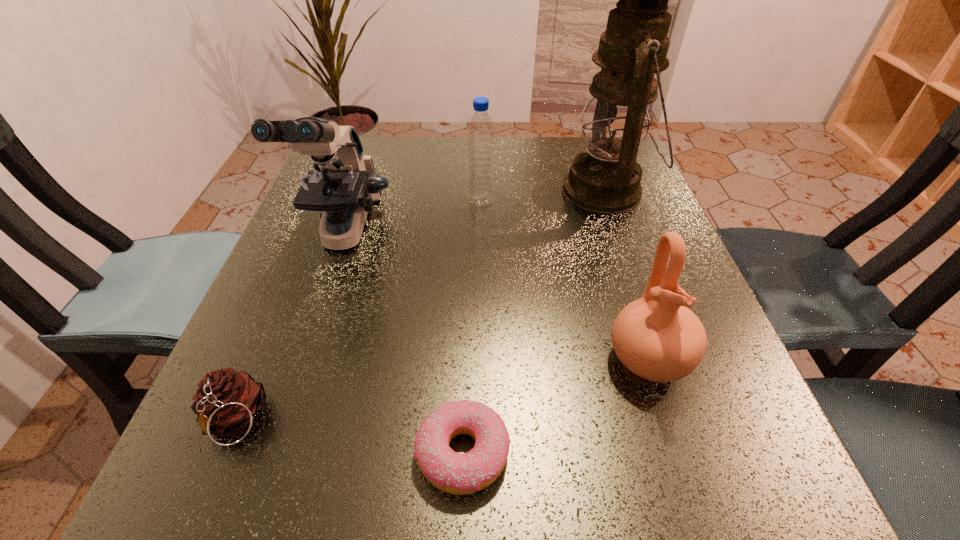
This screenshot has width=960, height=540. In order to click on free space at the far edge of the desktop in this screenshot , I will do `click(497, 188)`.

The height and width of the screenshot is (540, 960). Find the location of `vacant space at the left edge of the desktop`. vacant space at the left edge of the desktop is located at coordinates (334, 348).

The width and height of the screenshot is (960, 540). In the image, there is a desktop. What are the coordinates of `vacant space at the right edge` in the screenshot? It's located at (652, 215).

This screenshot has height=540, width=960. In order to click on free space between the shortest object and the fifth tallest object in this screenshot , I will do `click(349, 437)`.

I want to click on vacant area that lies between the microscope and the tallest object, so click(475, 212).

At what (x,y) coordinates should I click in order to perform the action: click on vacant point located between the tallest object and the pottery. Please return your answer as a coordinate pair (x, y). Looking at the image, I should click on (627, 275).

Where is `free space that is in between the pottery and the shortest object`? Image resolution: width=960 pixels, height=540 pixels. free space that is in between the pottery and the shortest object is located at coordinates (556, 406).

Locate an element on the screen. The height and width of the screenshot is (540, 960). free spot between the pottery and the microscope is located at coordinates (496, 296).

Locate an element on the screen. This screenshot has height=540, width=960. vacant space in between the water bottle and the oil lamp is located at coordinates (543, 195).

Image resolution: width=960 pixels, height=540 pixels. I want to click on unoccupied area between the pinecone and the water bottle, so click(x=358, y=311).